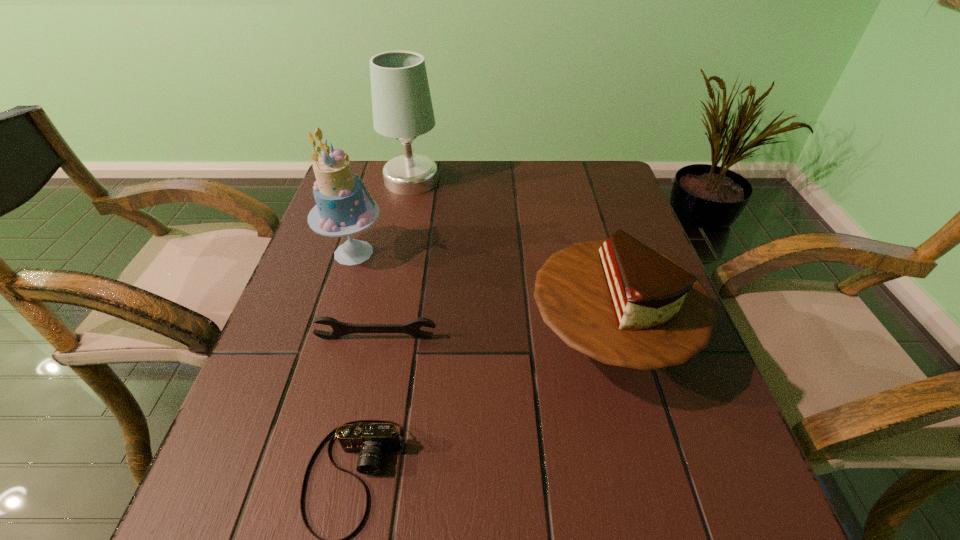
Where is `object that is at the far edge`? object that is at the far edge is located at coordinates (402, 107).

Identify the location of lampshade situated at the left edge. (402, 107).

The width and height of the screenshot is (960, 540). I want to click on cake located at the left edge, so click(x=342, y=208).

I want to click on wrench present at the left edge, so click(413, 327).

Identify the location of object that is at the right edge. pyautogui.click(x=618, y=301).

Find the location of `object located in the far left corner section of the desktop`. object located in the far left corner section of the desktop is located at coordinates (402, 107).

In the image, there is a desktop. Where is `free space at the far edge`? The image size is (960, 540). free space at the far edge is located at coordinates (467, 176).

Find the location of a particular element. free space at the near edge is located at coordinates (344, 529).

Where is `free space at the left edge of the desktop`? The height and width of the screenshot is (540, 960). free space at the left edge of the desktop is located at coordinates (354, 272).

Image resolution: width=960 pixels, height=540 pixels. Identify the location of free region at the right edge of the desktop. (635, 431).